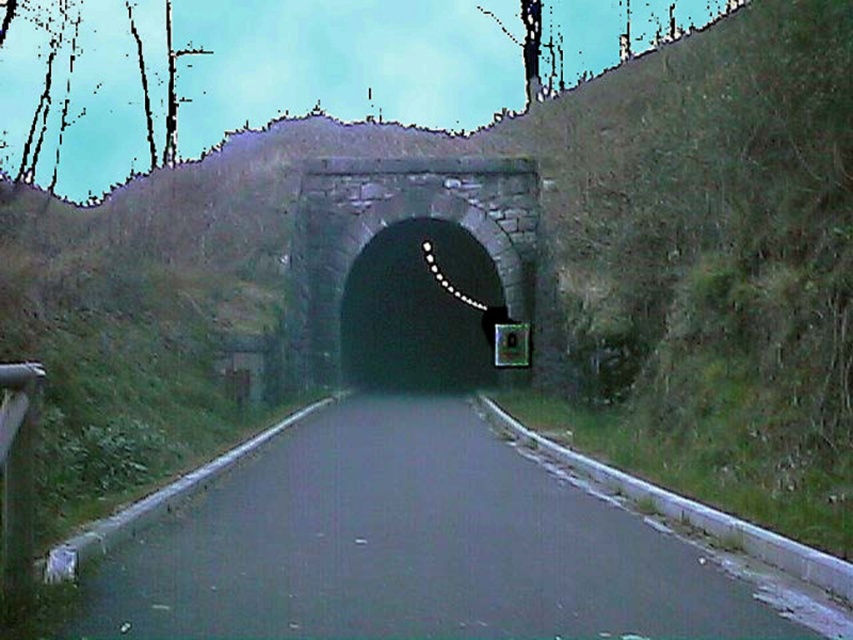
Question: Which point is closer to the camera?

Choices:
 (A) dark stone tunnel at center
 (B) asphalt road at center

Answer: (B)

Question: Does asphalt road at center have a greater width compared to dark stone tunnel at center?

Choices:
 (A) yes
 (B) no

Answer: (B)

Question: Is asphalt road at center positioned at the back of dark stone tunnel at center?

Choices:
 (A) yes
 (B) no

Answer: (B)

Question: Which object is farther from the camera taking this photo?

Choices:
 (A) asphalt road at center
 (B) dark stone tunnel at center

Answer: (B)

Question: Among these points, which one is farthest from the camera?

Choices:
 (A) (335, 234)
 (B) (416, 476)

Answer: (A)

Question: Can you confirm if asphalt road at center is smaller than dark stone tunnel at center?

Choices:
 (A) yes
 (B) no

Answer: (A)